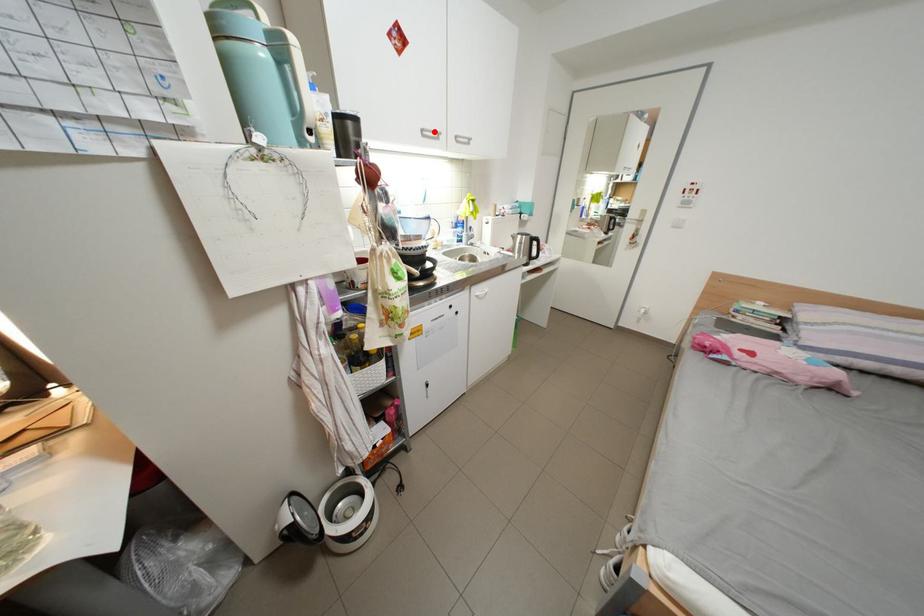
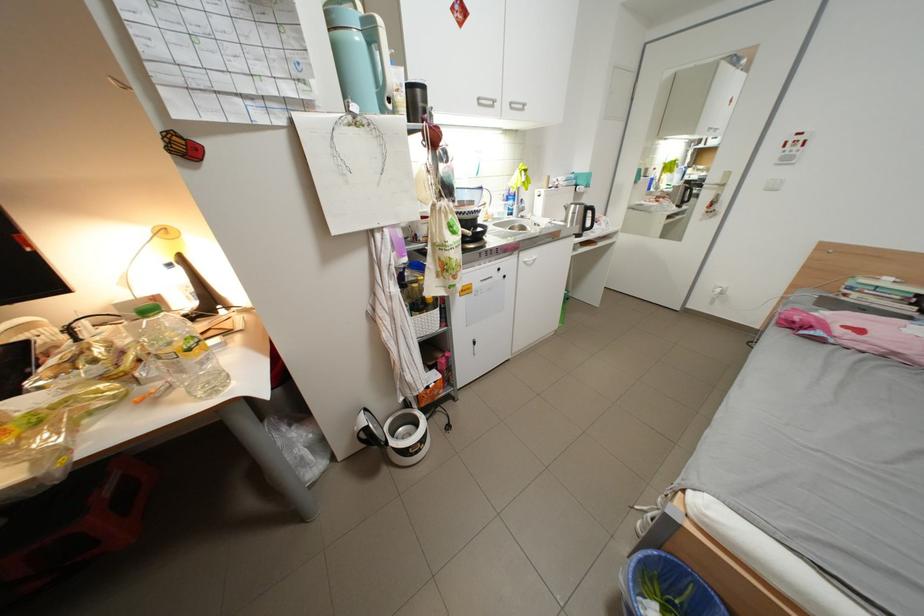
The point at the highlighted location is marked in the first image. Where is the corresponding point in the second image?

(490, 100)